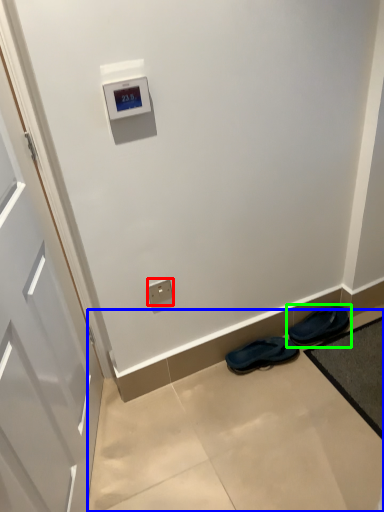
Question: Which object is the farthest from electric outlet (highlighted by a red box)? Choose among these: concrete (highlighted by a blue box) or footwear (highlighted by a green box).

Choices:
 (A) concrete
 (B) footwear

Answer: (B)